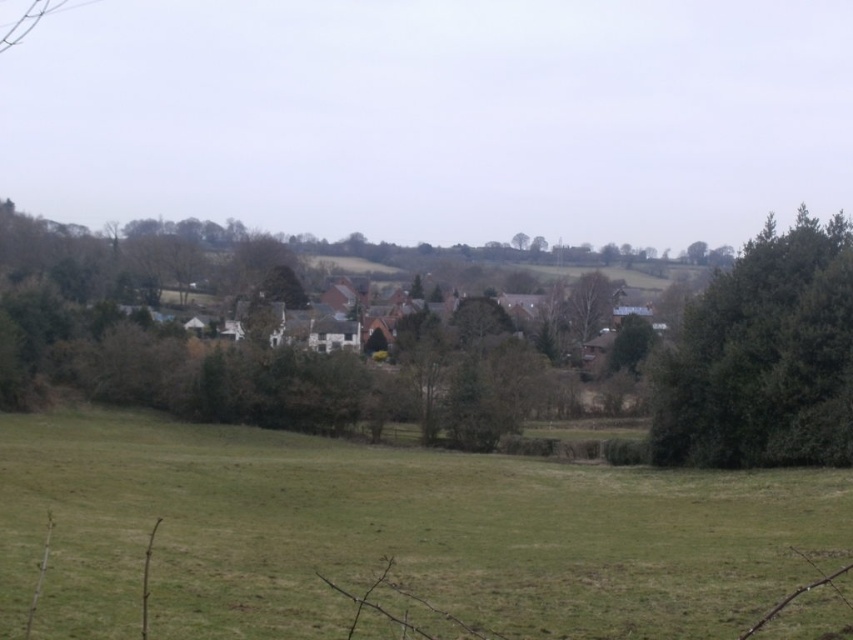
You are a farmer checking the field. You see the green grass at lower center and the green leafy tree at right. Which one covers a bigger area in the scene?

The green grass at lower center has a larger size compared to the green leafy tree at right, so it covers a bigger area in the scene.

You are a gardener planning to mow the green grass at lower center and trim the green leafy tree at right. Which area requires more attention in terms of width coverage?

The green grass at lower center requires more attention in terms of width coverage because its width is larger than the green leafy tree at right.